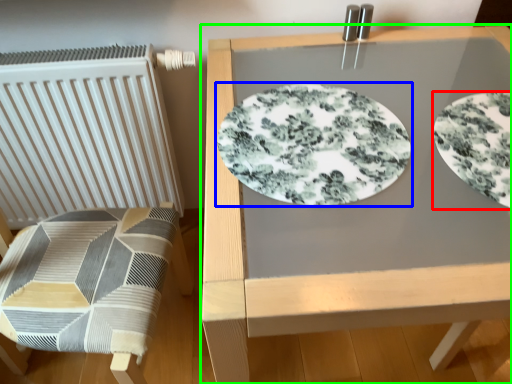
Question: Which object is the farthest from plate (highlighted by a red box)? Choose among these: plate (highlighted by a blue box) or table (highlighted by a green box).

Choices:
 (A) plate
 (B) table

Answer: (B)